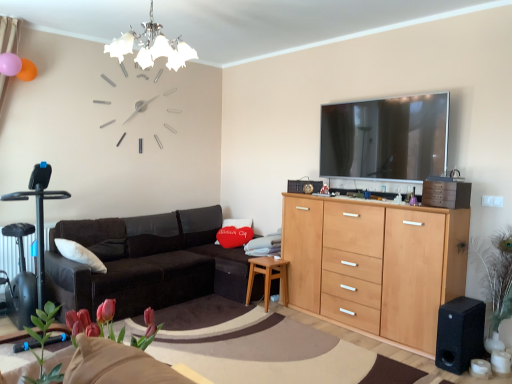
Question: Looking at their shapes, would you say pink matte tulips at lower left, which appears as the 2th plant when viewed from the left, is wider or thinner than green leafy plant at right, the 1th plant when ordered from back to front?

Choices:
 (A) wide
 (B) thin

Answer: (B)

Question: From a real-world perspective, is pink matte tulips at lower left, arranged as the second plant when viewed from the back, positioned above or below green leafy plant at right, which is the third plant from left to right?

Choices:
 (A) below
 (B) above

Answer: (B)

Question: Which object is positioned closest to the beech wood cabinet at center?

Choices:
 (A) light brown wooden side table at lower center
 (B) black plastic swivel chair at left
 (C) green leafy plant at right, placed as the 3th plant when sorted from front to back
 (D) matte orange balloon at upper left, the 1th balloon in the back-to-front sequence
 (E) pink matte tulips at lower left, which appears as the 2th plant when viewed from the left

Answer: (C)

Question: Which object is the closest to the beech wood cabinet at center?

Choices:
 (A) black leather couch at center
 (B) green leafy plant at right, which ranks as the 1th plant in right-to-left order
 (C) chrome/textured glass chandelier at upper center
 (D) green leafy plant at lower left, arranged as the first plant when viewed from the front
 (E) velvety red heart at center

Answer: (B)